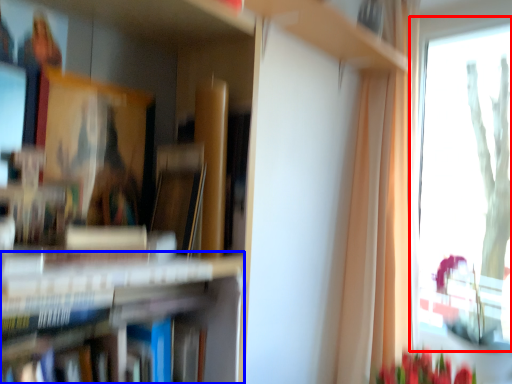
Question: Which object appears closest to the camera in this image, window (highlighted by a red box) or bookshelf (highlighted by a blue box)?

Choices:
 (A) window
 (B) bookshelf

Answer: (B)